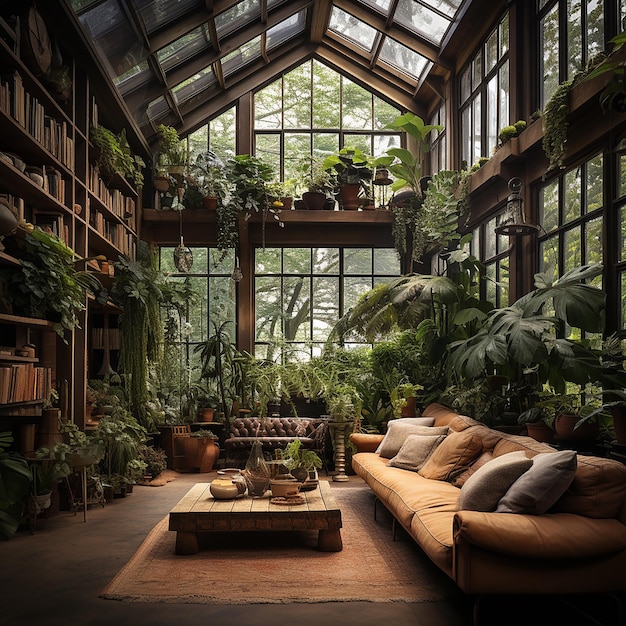
The width and height of the screenshot is (626, 626). In order to click on woosen planks that make up tabletops in this screenshot , I will do `click(183, 505)`, `click(201, 506)`, `click(220, 506)`, `click(240, 505)`, `click(259, 505)`, `click(274, 505)`, `click(294, 506)`, `click(313, 505)`, `click(326, 500)`.